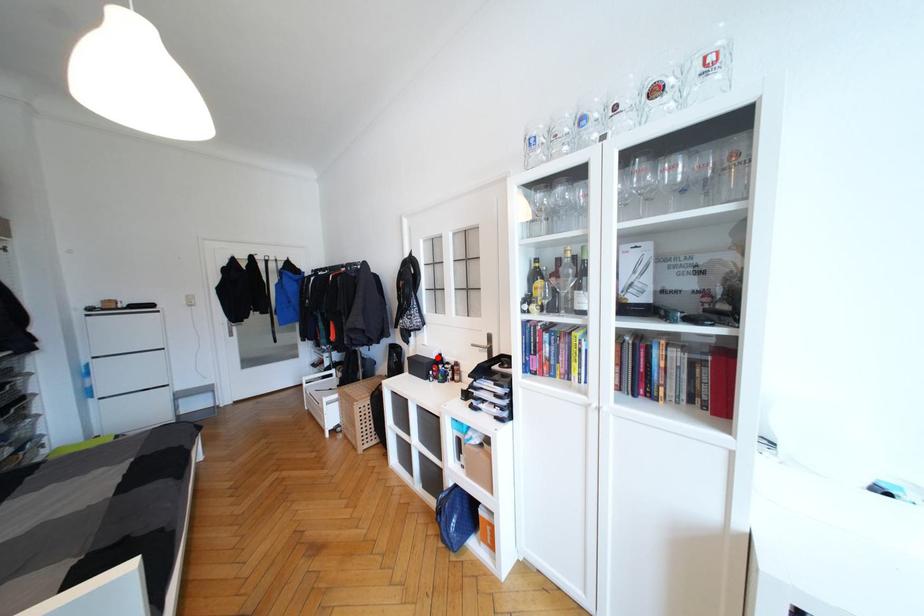
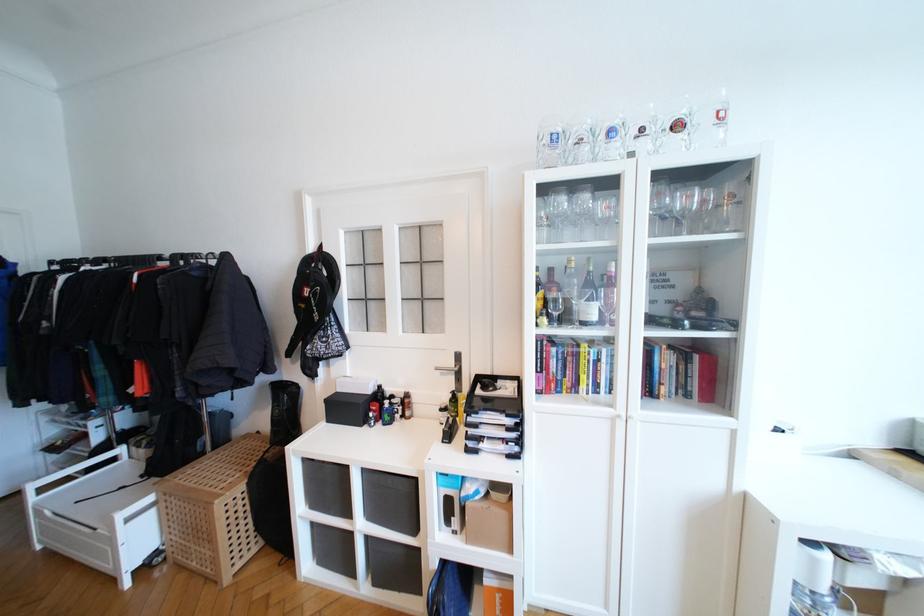
Locate, in the second image, the point that corresponds to the highlighted location in the first image.

(372, 392)